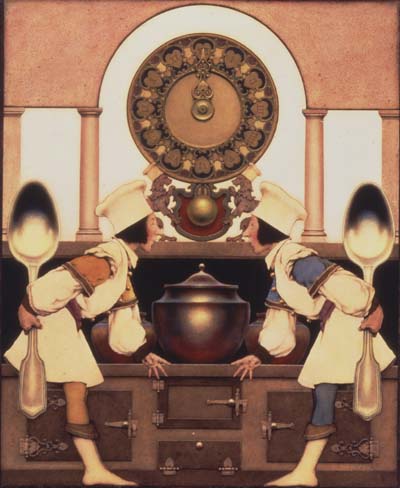
This screenshot has height=488, width=400. What are the coordinates of `door` in the screenshot? It's located at (233, 401).